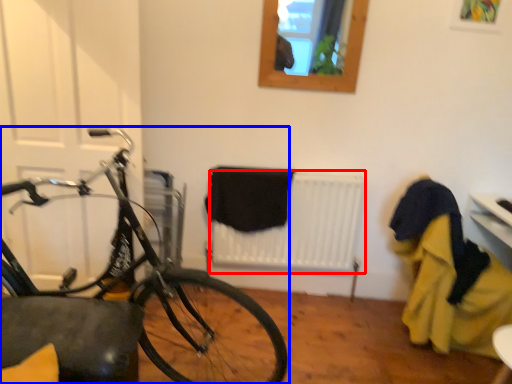
Question: Which of the following is the farthest to the observer, radiator (highlighted by a red box) or bicycle (highlighted by a blue box)?

Choices:
 (A) radiator
 (B) bicycle

Answer: (A)